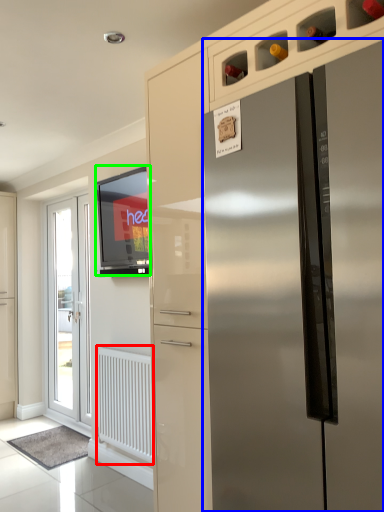
Question: Based on their relative distances, which object is farther from radiator (highlighted by a red box)? Choose from refrigerator (highlighted by a blue box) and window screen (highlighted by a green box).

Choices:
 (A) refrigerator
 (B) window screen

Answer: (A)